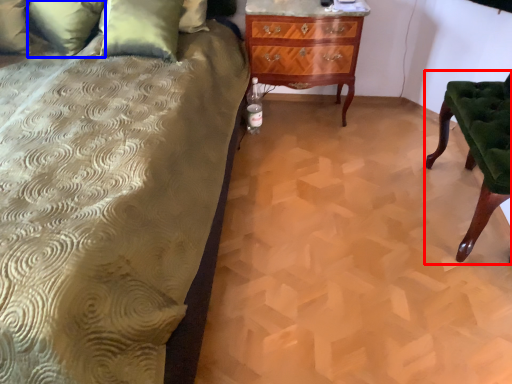
Question: Which point is further to the camera, furniture (highlighted by a red box) or pillow (highlighted by a blue box)?

Choices:
 (A) furniture
 (B) pillow

Answer: (B)